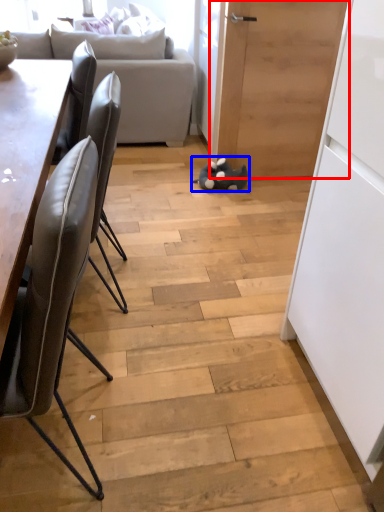
Question: Which object appears closest to the camera in this image, door (highlighted by a red box) or toy (highlighted by a blue box)?

Choices:
 (A) door
 (B) toy

Answer: (A)